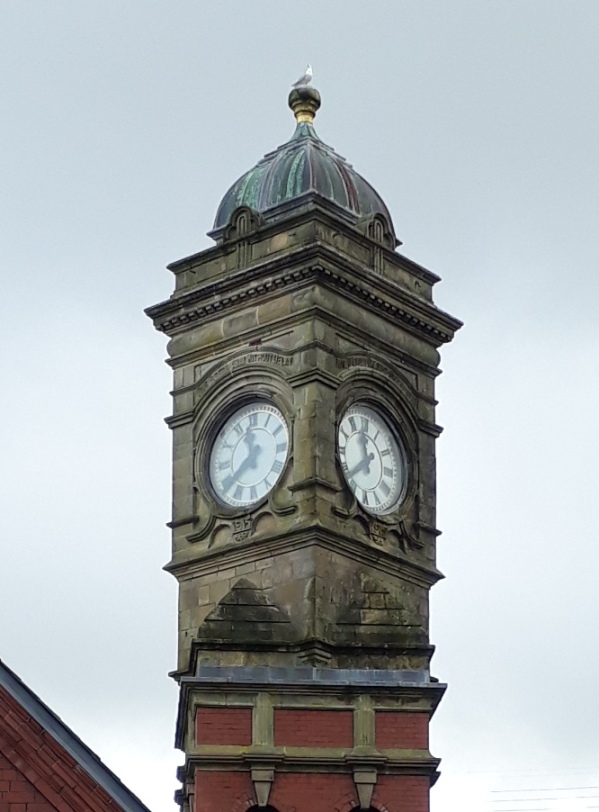
Find the location of a particular element. The image size is (599, 812). clock is located at coordinates (259, 445), (375, 458).